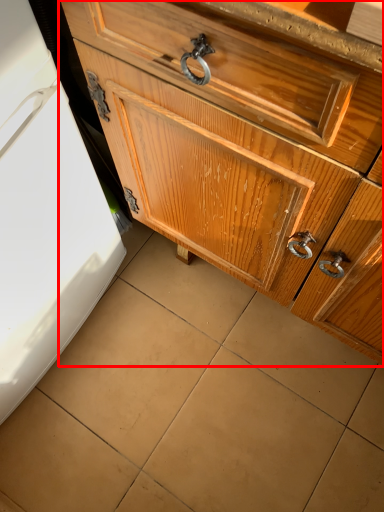
Question: From the image's perspective, what is the correct spatial positioning of chest of drawers (annotated by the red box) in reference to tile?

Choices:
 (A) above
 (B) below

Answer: (A)